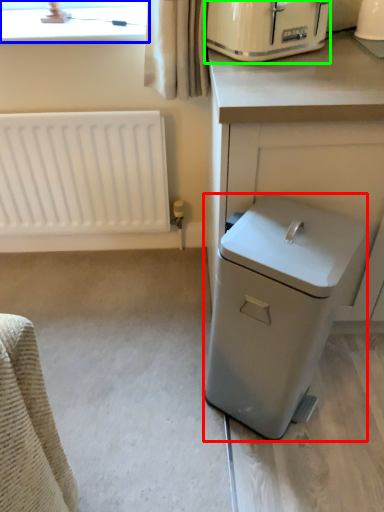
Question: Based on their relative distances, which object is nearer to dish washer (highlighted by a red box)? Choose from bay window (highlighted by a blue box) and home appliance (highlighted by a green box).

Choices:
 (A) bay window
 (B) home appliance

Answer: (B)